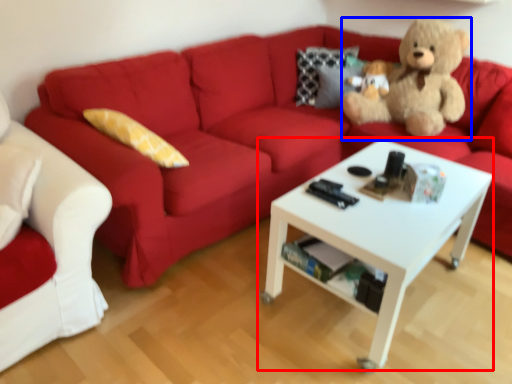
Question: Among these objects, which one is farthest to the camera, coffee table (highlighted by a red box) or teddy bear (highlighted by a blue box)?

Choices:
 (A) coffee table
 (B) teddy bear

Answer: (B)